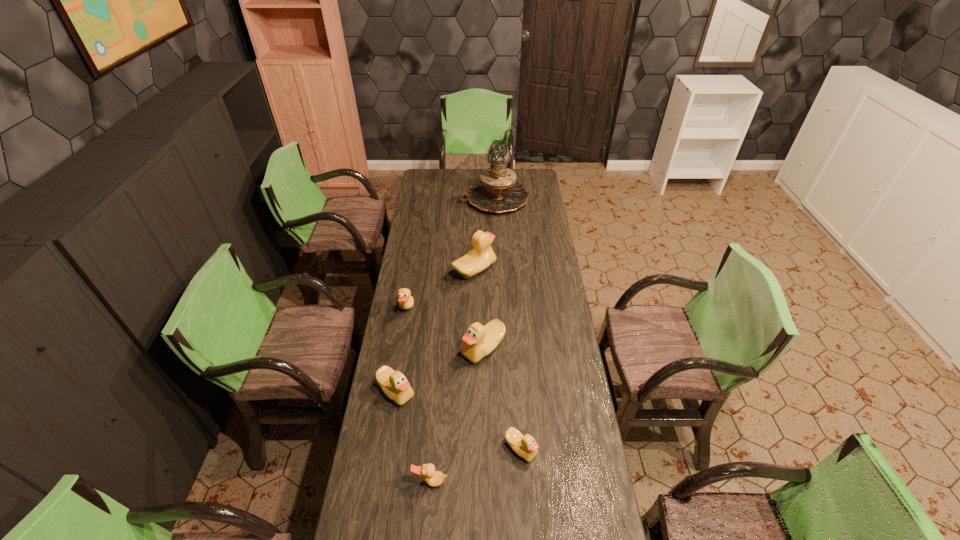
Locate an element on the screen. The width and height of the screenshot is (960, 540). the second closest duck to the fifth shortest object is located at coordinates (405, 300).

Find the location of a particular element. This screenshot has width=960, height=540. beige duck that is the second closest to the left tan duck is located at coordinates (479, 341).

Identify which beige duck is the third nearest to the third nearest beige duck. Please provide its 2D coordinates. Your answer should be formatted as a tuple, i.e. [(x, y)], where the tuple contains the x and y coordinates of a point satisfying the conditions above.

[(526, 447)]